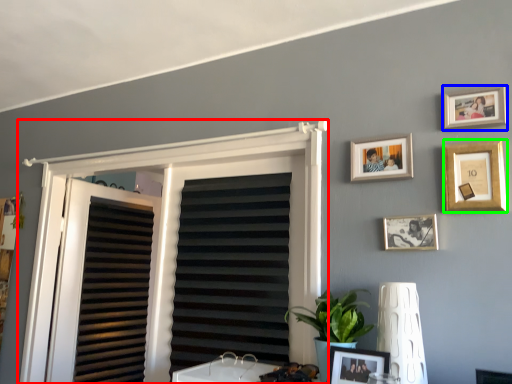
Question: Which object is the farthest from window frame (highlighted by a red box)? Choose among these: picture frame (highlighted by a blue box) or picture frame (highlighted by a green box).

Choices:
 (A) picture frame
 (B) picture frame

Answer: (A)